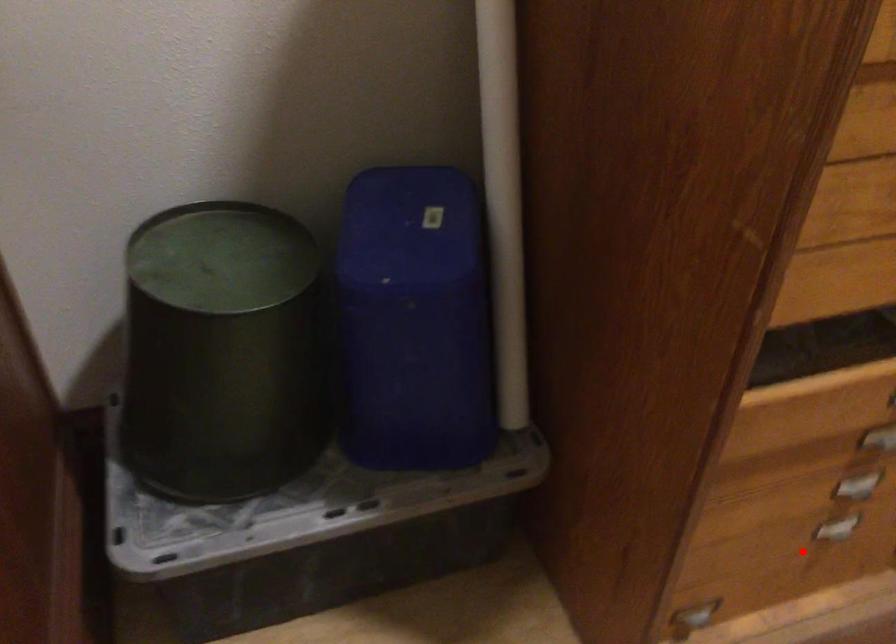
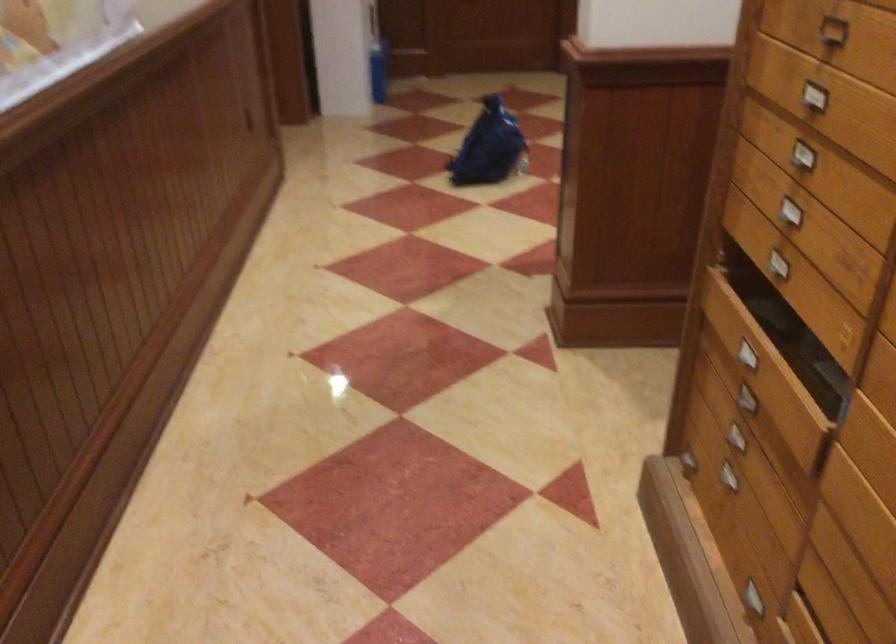
Question: I am providing you with two images of the same scene from different viewpoints. Given a red point in image1, look at the same physical point in image2. Is it:

Choices:
 (A) Closer to the viewpoint
 (B) Farther from the viewpoint

Answer: (B)